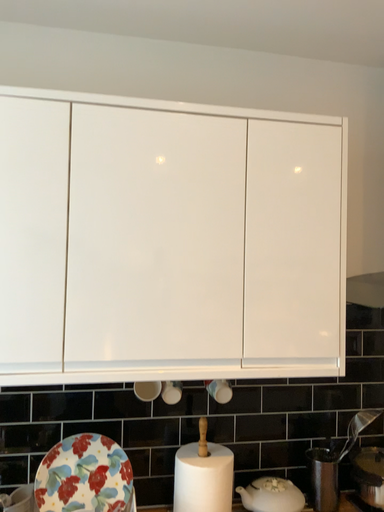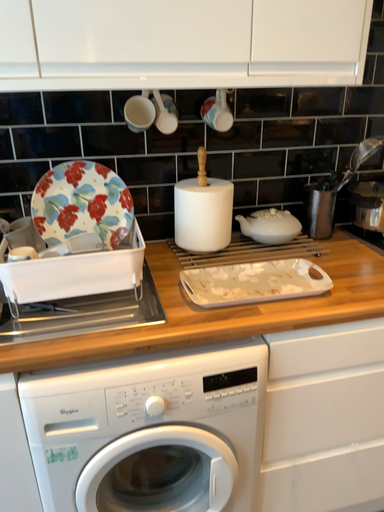
Question: Which way did the camera rotate in the video?

Choices:
 (A) rotated upward
 (B) rotated downward

Answer: (B)